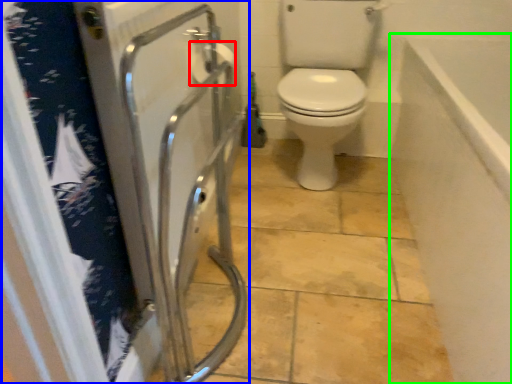
Question: Based on their relative distances, which object is nearer to toilet paper (highlighted by a red box)? Choose from screen door (highlighted by a blue box) and bath (highlighted by a green box).

Choices:
 (A) screen door
 (B) bath

Answer: (A)